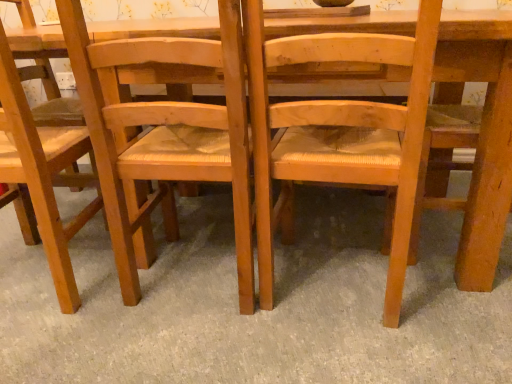
Where is `free region under natural wood chair at center, which ranks as the first chair in right-to-left order (from a real-world perspective)`? The height and width of the screenshot is (384, 512). free region under natural wood chair at center, which ranks as the first chair in right-to-left order (from a real-world perspective) is located at coordinates 331,278.